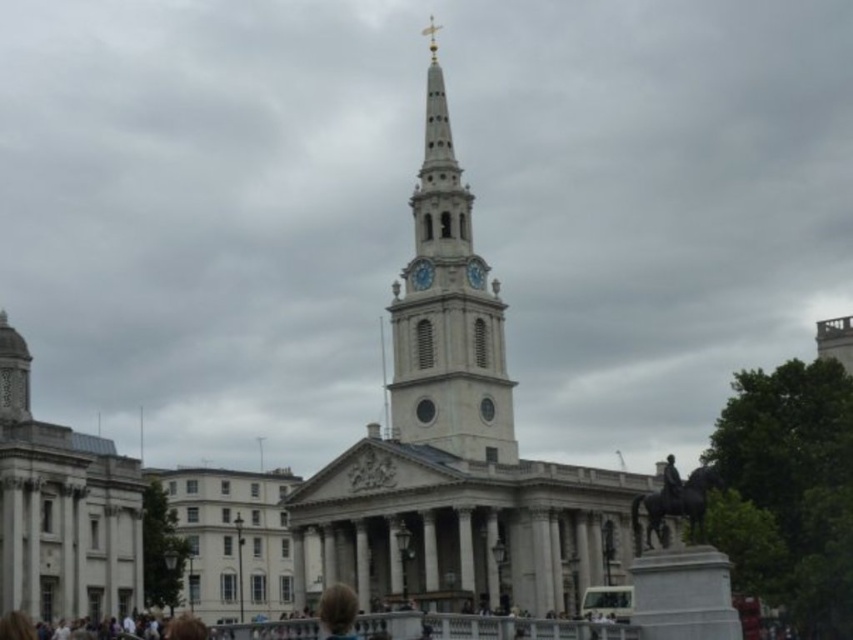
Describe the element at coordinates (62, 508) in the screenshot. I see `white stone building at left` at that location.

Does white stone building at left appear on the right side of blue painted metal clock at center?

In fact, white stone building at left is to the left of blue painted metal clock at center.

Where is `white stone building at left`? The image size is (853, 640). white stone building at left is located at coordinates (62, 508).

The width and height of the screenshot is (853, 640). Find the location of `white stone building at left`. white stone building at left is located at coordinates [x=62, y=508].

What are the coordinates of `white stone clock tower at center` in the screenshot? It's located at (447, 314).

Between point (444, 164) and point (479, 282), which one is positioned behind?

The point (444, 164) is behind.

Is point (469, 346) positioned behind point (480, 285)?

That is False.

At what (x,y) coordinates should I click in order to perform the action: click on white stone clock tower at center. Please return your answer as a coordinate pair (x, y). Image resolution: width=853 pixels, height=640 pixels. Looking at the image, I should click on (447, 314).

Is point (28, 435) positioned in front of point (344, 621)?

No.

Which is behind, point (25, 611) or point (344, 618)?

The point (25, 611) is behind.

The height and width of the screenshot is (640, 853). Identify the location of white stone building at left. (62, 508).